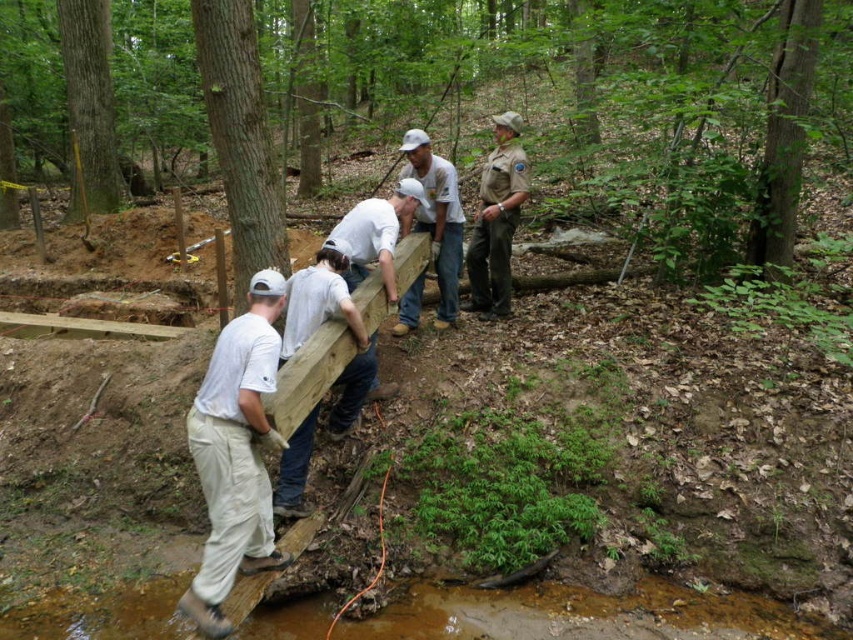
You are a hiker trying to cross the stream using the wooden plank bridge. You notice two workers wearing white cotton shirt at left and white matte shirt at center. Which worker is standing closer to the stream?

The white cotton shirt at left is below the white matte shirt at center, meaning the worker in the white cotton shirt at left is closer to the stream.